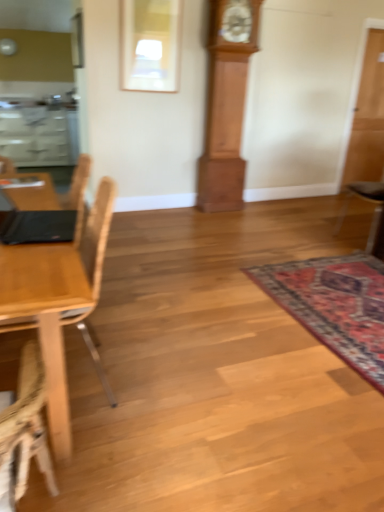
I want to click on unoccupied area behind light wood chair at left, which appears as the second chair when viewed from the back, so click(x=130, y=324).